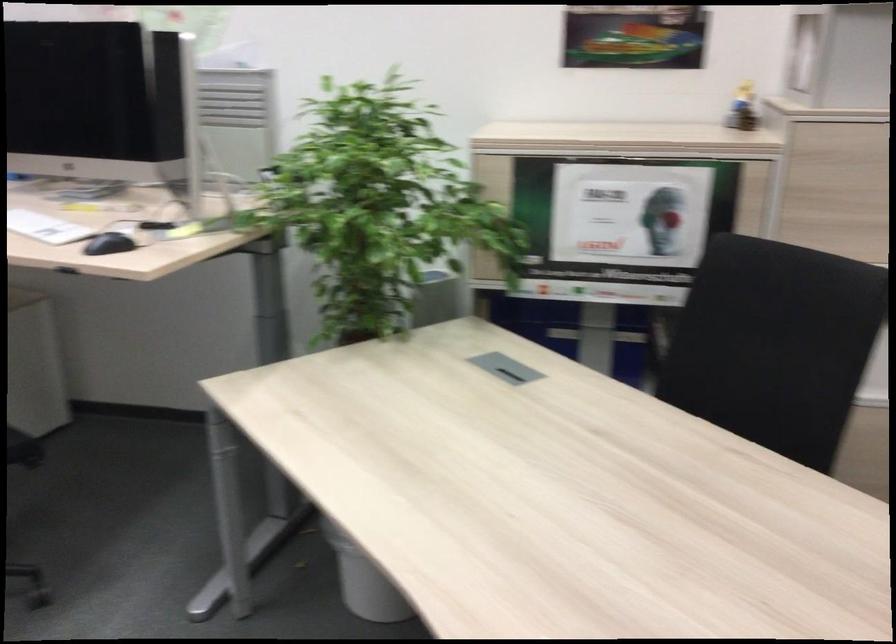
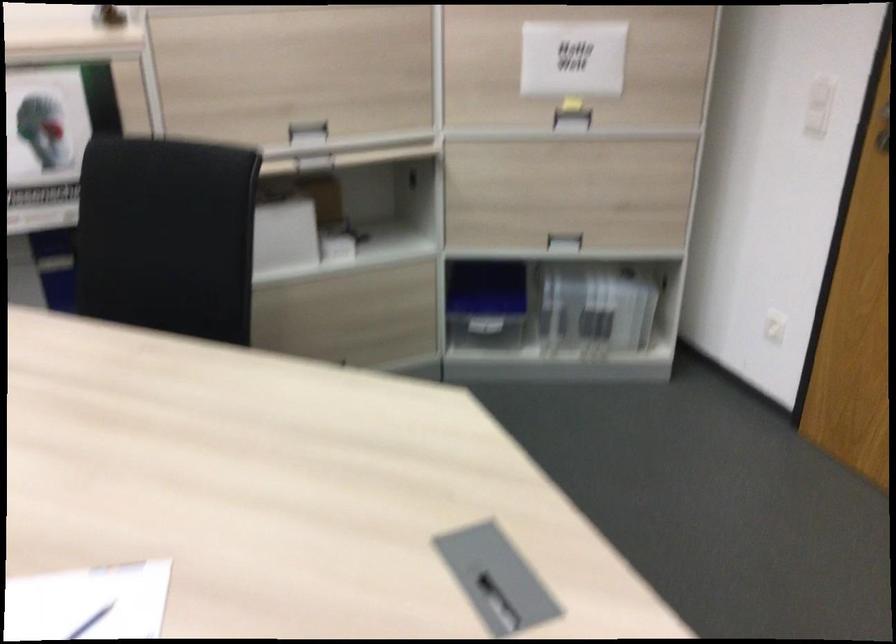
Question: The camera is either moving clockwise (left) or counter-clockwise (right) around the object. The first image is from the beginning of the video and the second image is from the end. Is the camera moving left or right when shooting the video?

Choices:
 (A) Left
 (B) Right

Answer: (A)